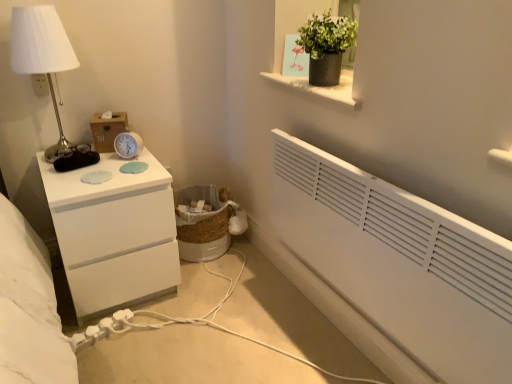
What are the coordinates of `vacant area in front of wooden tissue box at upper left` in the screenshot? It's located at (103, 172).